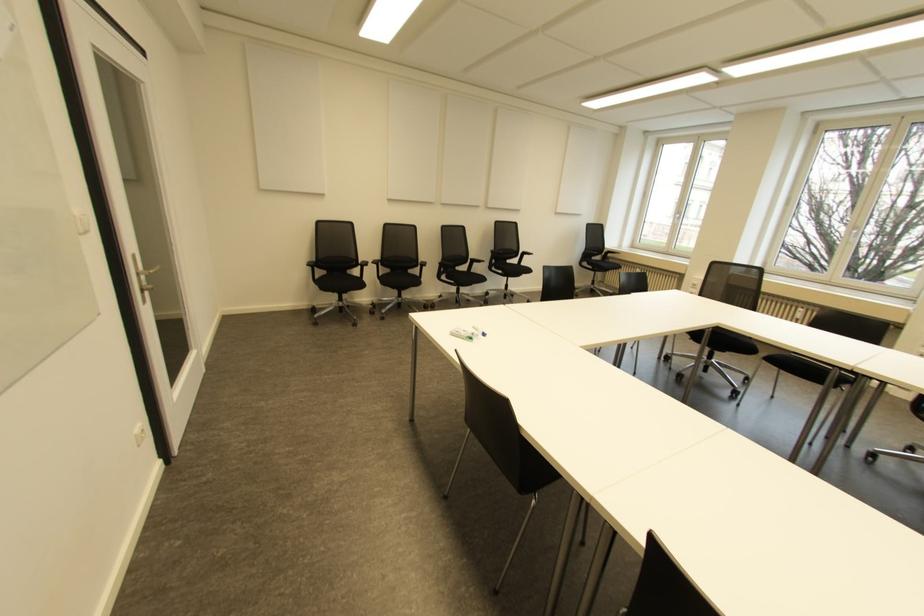
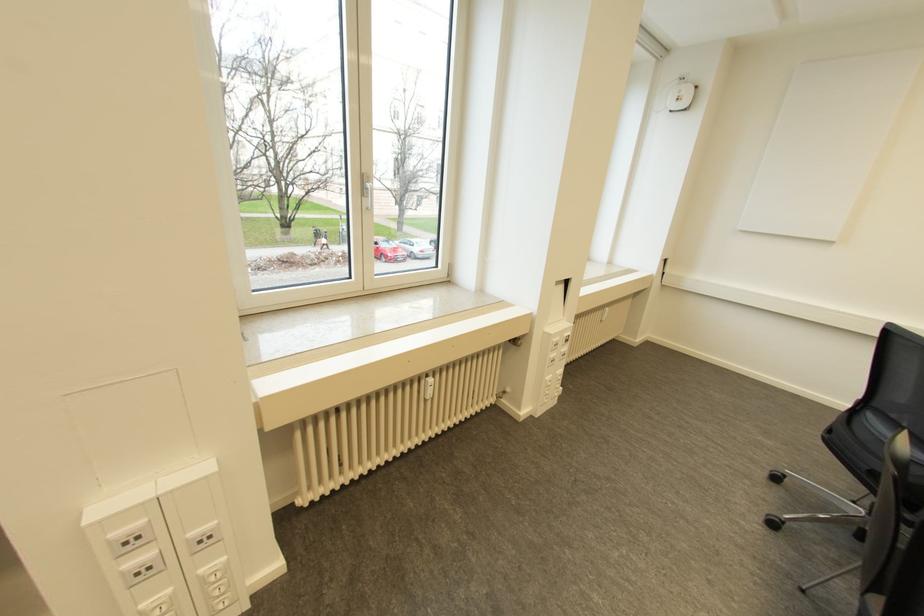
The point at (800, 309) is marked in the first image. Where is the corresponding point in the second image?

(430, 379)